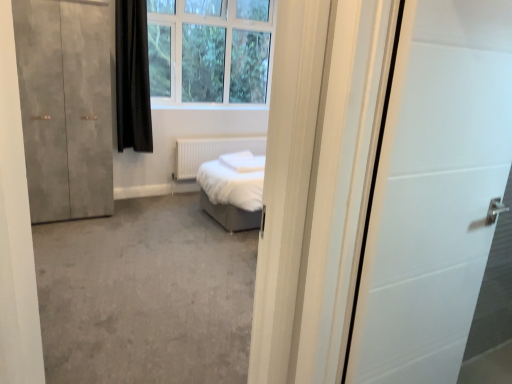
Question: Is white plastic window at upper center in front of or behind matte concrete wardrobe at left in the image?

Choices:
 (A) behind
 (B) front

Answer: (A)

Question: Is white plastic window at upper center taller or shorter than matte concrete wardrobe at left?

Choices:
 (A) tall
 (B) short

Answer: (B)

Question: Estimate the real-world distances between objects in this image. Which object is farther from the black matte curtain at upper left?

Choices:
 (A) white matte radiator at center
 (B) white plastic window at upper center
 (C) matte concrete wardrobe at left

Answer: (A)

Question: Considering the real-world distances, which object is farthest from the matte concrete wardrobe at left?

Choices:
 (A) black matte curtain at upper left
 (B) white plastic window at upper center
 (C) white matte radiator at center

Answer: (C)